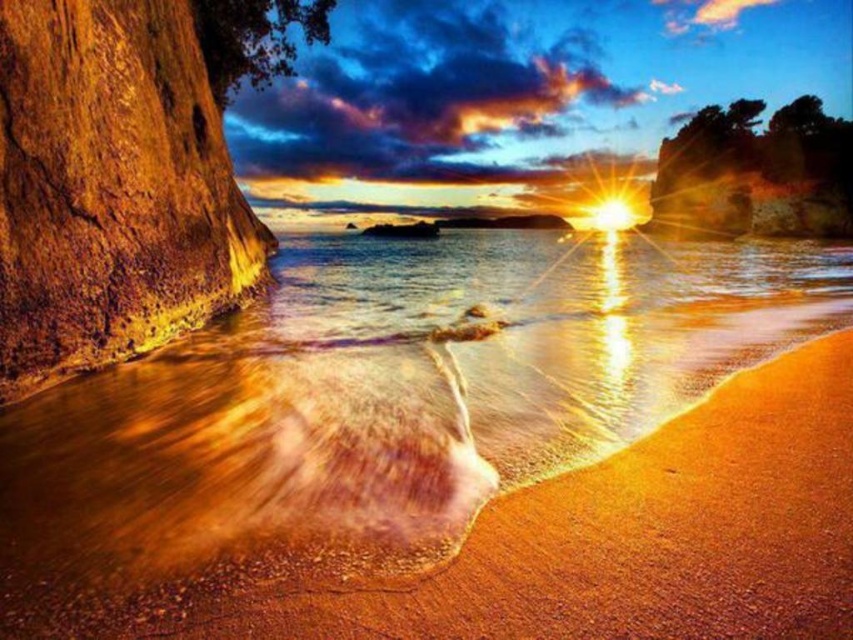
Question: Which point appears closest to the camera in this image?

Choices:
 (A) (119, 163)
 (B) (706, 244)

Answer: (A)

Question: Is golden sand at lower center smaller than rusty wood rock at left?

Choices:
 (A) yes
 (B) no

Answer: (B)

Question: Among these objects, which one is nearest to the camera?

Choices:
 (A) rusty wood rock at left
 (B) golden sand at lower center

Answer: (B)

Question: Can you confirm if golden sand at lower center is wider than rusty wood rock at left?

Choices:
 (A) no
 (B) yes

Answer: (B)

Question: Does golden sand at lower center appear on the right side of rusty wood rock at left?

Choices:
 (A) yes
 (B) no

Answer: (A)